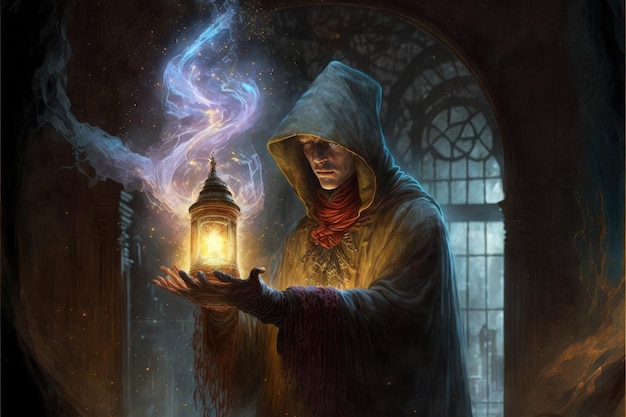
Locate an element on the screen. Image resolution: width=626 pixels, height=417 pixels. hood is located at coordinates (308, 95).